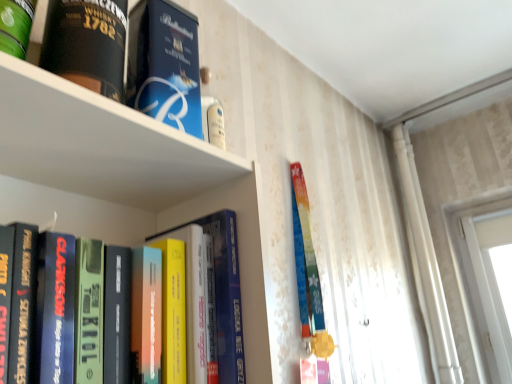
Question: From a real-world perspective, does hardcover book at left, marked as the first book in a bottom-to-top arrangement, stand above green matte canister at upper left, which is counted as the 4th book, starting from the bottom?

Choices:
 (A) no
 (B) yes

Answer: (A)

Question: From the image's perspective, is hardcover book at left, marked as the first book in a bottom-to-top arrangement, on green matte canister at upper left, which appears as the 1th book when viewed from the top?

Choices:
 (A) yes
 (B) no

Answer: (B)

Question: From the image's perspective, is hardcover book at left, arranged as the fourth book when viewed from the top, below green matte canister at upper left, which is counted as the 4th book, starting from the bottom?

Choices:
 (A) no
 (B) yes

Answer: (B)

Question: Considering the relative sizes of hardcover book at left, arranged as the fourth book when viewed from the top, and green matte canister at upper left, which appears as the 1th book when viewed from the top, in the image provided, is hardcover book at left, arranged as the fourth book when viewed from the top, bigger than green matte canister at upper left, which appears as the 1th book when viewed from the top,?

Choices:
 (A) yes
 (B) no

Answer: (A)

Question: Is green matte canister at upper left, which appears as the 1th book when viewed from the top, located within hardcover book at left, arranged as the fourth book when viewed from the top?

Choices:
 (A) no
 (B) yes

Answer: (A)

Question: Considering the relative positions of hardcover book at left, arranged as the fourth book when viewed from the top, and green matte canister at upper left, which appears as the 1th book when viewed from the top, in the image provided, is hardcover book at left, arranged as the fourth book when viewed from the top, to the right of green matte canister at upper left, which appears as the 1th book when viewed from the top, from the viewer's perspective?

Choices:
 (A) yes
 (B) no

Answer: (A)

Question: Is black matte whiskey bottle at upper left, which is the 3th book from bottom to top, positioned before blue cardboard box at upper center, placed as the third book when sorted from top to bottom?

Choices:
 (A) no
 (B) yes

Answer: (B)

Question: Is black matte whiskey bottle at upper left, which is counted as the second book, starting from the top, positioned far away from blue cardboard box at upper center, placed as the third book when sorted from top to bottom?

Choices:
 (A) yes
 (B) no

Answer: (B)

Question: Can you confirm if black matte whiskey bottle at upper left, which is counted as the second book, starting from the top, is taller than blue cardboard box at upper center, positioned as the second book in bottom-to-top order?

Choices:
 (A) no
 (B) yes

Answer: (B)

Question: From the image's perspective, does black matte whiskey bottle at upper left, which is counted as the second book, starting from the top, appear higher than blue cardboard box at upper center, positioned as the second book in bottom-to-top order?

Choices:
 (A) yes
 (B) no

Answer: (A)

Question: From the image's perspective, would you say black matte whiskey bottle at upper left, which is the 3th book from bottom to top, is shown under blue cardboard box at upper center, placed as the third book when sorted from top to bottom?

Choices:
 (A) yes
 (B) no

Answer: (B)

Question: Could you tell me if black matte whiskey bottle at upper left, which is counted as the second book, starting from the top, is facing blue cardboard box at upper center, placed as the third book when sorted from top to bottom?

Choices:
 (A) yes
 (B) no

Answer: (B)

Question: Can you confirm if blue cardboard box at upper center, positioned as the second book in bottom-to-top order, is smaller than hardcover book at left, marked as the first book in a bottom-to-top arrangement?

Choices:
 (A) no
 (B) yes

Answer: (B)